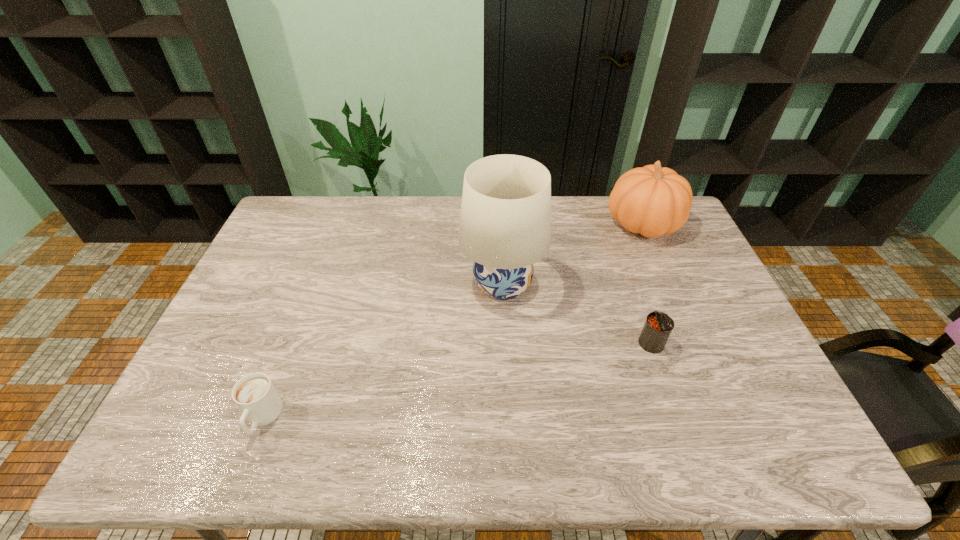
You are a GUI agent. You are given a task and a screenshot of the screen. Output one action in this format:
    pyautogui.click(x=<x>, y=<y>)
    Task: Click on the second farthest object
    The image size is (960, 540).
    Given the screenshot: What is the action you would take?
    pyautogui.click(x=505, y=223)

The image size is (960, 540). In order to click on the second object from left to right in this screenshot , I will do `click(505, 223)`.

Identify the location of the third shortest object. (652, 201).

You are a GUI agent. You are given a task and a screenshot of the screen. Output one action in this format:
    pyautogui.click(x=<x>, y=<y>)
    Task: Click on the farthest object
    This screenshot has width=960, height=540.
    Given the screenshot: What is the action you would take?
    pyautogui.click(x=652, y=201)

The image size is (960, 540). In order to click on the second shortest object in this screenshot , I will do `click(658, 326)`.

This screenshot has width=960, height=540. Find the location of `the third farthest object`. the third farthest object is located at coordinates (658, 326).

You are a GUI agent. You are given a task and a screenshot of the screen. Output one action in this format:
    pyautogui.click(x=<x>, y=<y>)
    Task: Click on the shortest object
    The image size is (960, 540).
    Given the screenshot: What is the action you would take?
    pyautogui.click(x=255, y=395)

Where is `the nearest object`? This screenshot has height=540, width=960. the nearest object is located at coordinates (255, 395).

You are a GUI agent. You are given a task and a screenshot of the screen. Output one action in this format:
    pyautogui.click(x=<x>, y=<y>)
    Task: Click on the free spot located 0.200m on the front-facing side of the second object from left to right
    The width and height of the screenshot is (960, 540).
    Given the screenshot: What is the action you would take?
    pyautogui.click(x=396, y=285)

Where is `vacant area located on the front-facing side of the second object from left to right`? vacant area located on the front-facing side of the second object from left to right is located at coordinates (415, 285).